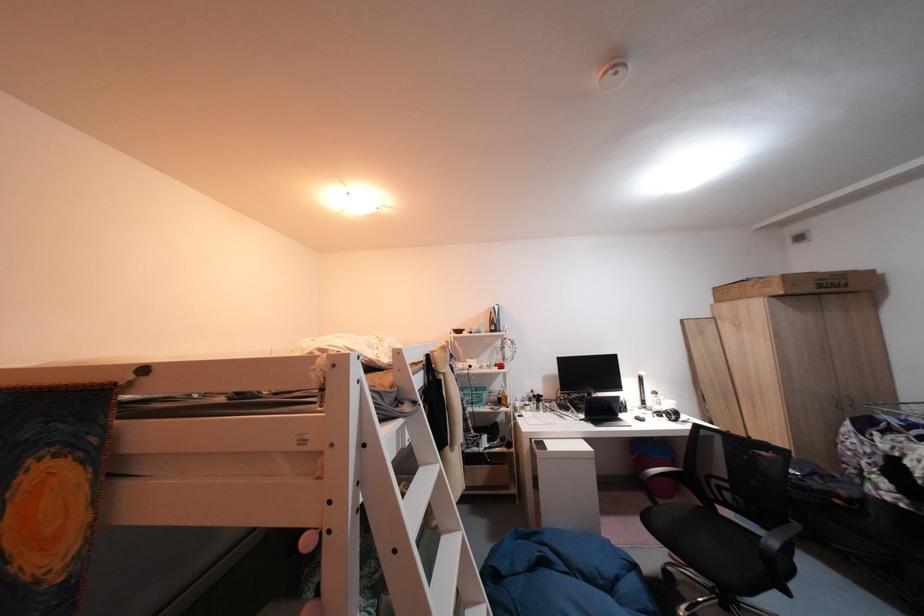
Find where to rest the black chair armrest. Please return your answer as a coordinate pair (x, y).

(777, 544)